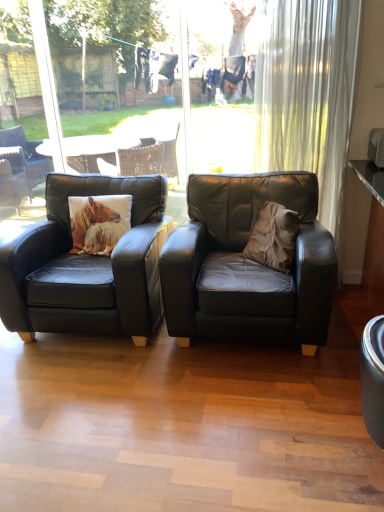
Question: Is there a large distance between transparent glass window at center and brown suede throw pillow at center?

Choices:
 (A) yes
 (B) no

Answer: (A)

Question: From a real-world perspective, is transparent glass window at center under brown suede throw pillow at center?

Choices:
 (A) yes
 (B) no

Answer: (B)

Question: Does transparent glass window at center have a lesser height compared to brown suede throw pillow at center?

Choices:
 (A) yes
 (B) no

Answer: (B)

Question: From the image's perspective, does transparent glass window at center appear higher than brown suede throw pillow at center?

Choices:
 (A) no
 (B) yes

Answer: (B)

Question: Considering the relative sizes of transparent glass window at center and brown suede throw pillow at center in the image provided, is transparent glass window at center thinner than brown suede throw pillow at center?

Choices:
 (A) yes
 (B) no

Answer: (A)

Question: Is transparent glass window at center aimed at brown suede throw pillow at center?

Choices:
 (A) yes
 (B) no

Answer: (B)

Question: Does white textured pillow at left come in front of white sheer curtain at upper right?

Choices:
 (A) yes
 (B) no

Answer: (B)

Question: Can you confirm if white textured pillow at left is wider than white sheer curtain at upper right?

Choices:
 (A) yes
 (B) no

Answer: (A)

Question: Considering the relative sizes of white textured pillow at left and white sheer curtain at upper right in the image provided, is white textured pillow at left shorter than white sheer curtain at upper right?

Choices:
 (A) yes
 (B) no

Answer: (A)

Question: Is white textured pillow at left with white sheer curtain at upper right?

Choices:
 (A) yes
 (B) no

Answer: (B)

Question: From a real-world perspective, is white textured pillow at left positioned under white sheer curtain at upper right based on gravity?

Choices:
 (A) yes
 (B) no

Answer: (A)

Question: Can white sheer curtain at upper right be found inside white textured pillow at left?

Choices:
 (A) no
 (B) yes

Answer: (A)

Question: Would you say transparent glass window at center is outside black leather chair at center, which appears as the second chair when viewed from the right?

Choices:
 (A) yes
 (B) no

Answer: (A)